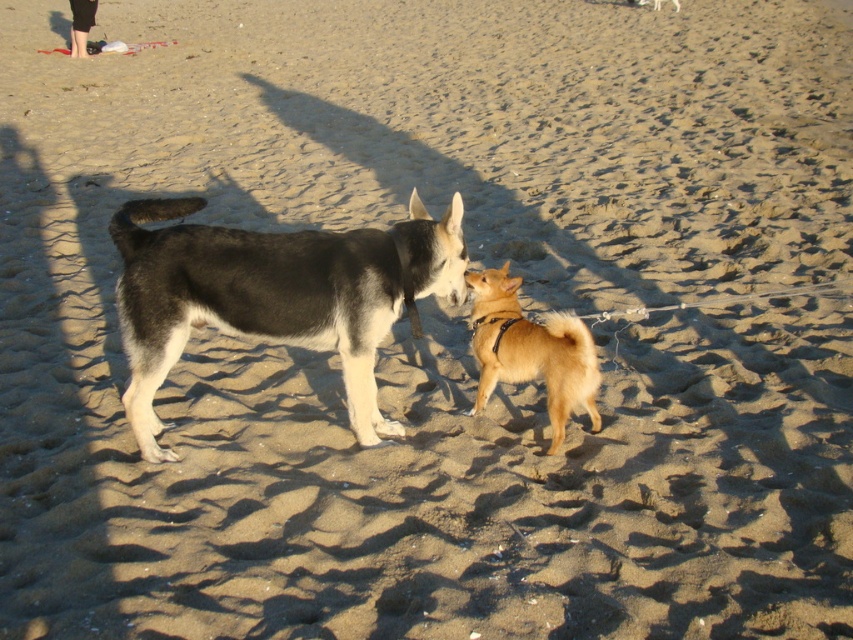
You are a photographer at the beach and want to capture a photo of the golden fur dog at center and the black leather pants at upper left. Which object is shorter?

The golden fur dog at center is shorter than the black leather pants at upper left.

You are a photographer at the beach scene. You need to decide which object to focus on first between the black and white fur dog at center and the black leather pants at upper left. Which one should you choose based on their sizes?

The black and white fur dog at center is bigger than the black leather pants at upper left, so you should focus on the black and white fur dog at center first because it is larger in size.